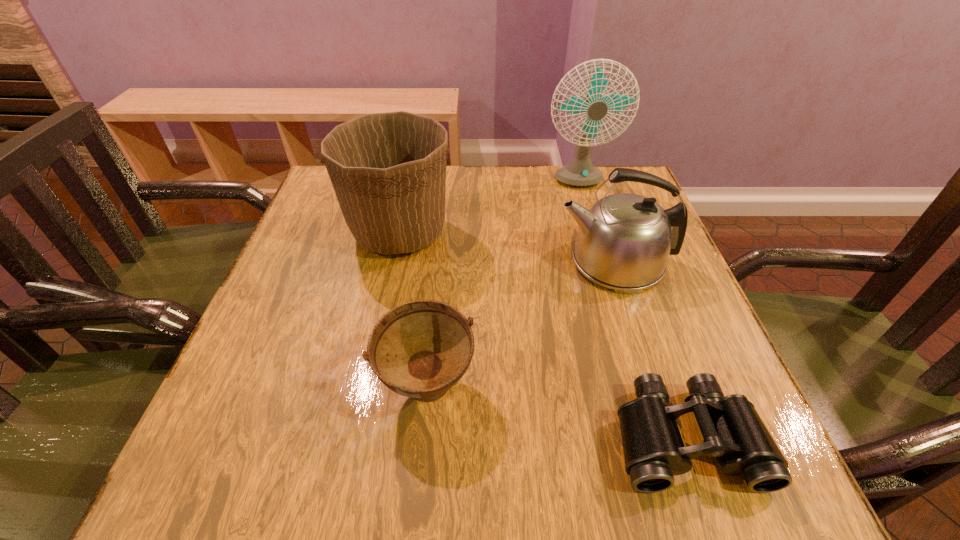
Locate an element on the screen. Image resolution: width=960 pixels, height=540 pixels. free point between the binoculars and the fan is located at coordinates (632, 310).

The height and width of the screenshot is (540, 960). I want to click on free area in between the farthest object and the flowerpot, so click(489, 208).

You are a GUI agent. You are given a task and a screenshot of the screen. Output one action in this format:
    pyautogui.click(x=<x>, y=<y>)
    Task: Click on the free space between the farthest object and the flowerpot
    
    Given the screenshot: What is the action you would take?
    pyautogui.click(x=489, y=208)

At what (x,y) coordinates should I click in order to perform the action: click on vacant area between the binoculars and the kettle. Please return your answer as a coordinate pair (x, y). The image size is (960, 540). Looking at the image, I should click on (650, 349).

At what (x,y) coordinates should I click in order to perform the action: click on unoccupied area between the flowerpot and the binoculars. Please return your answer as a coordinate pair (x, y). The width and height of the screenshot is (960, 540). Looking at the image, I should click on (542, 335).

Where is `object that can be found as the closest to the soup bowl`? object that can be found as the closest to the soup bowl is located at coordinates (733, 432).

This screenshot has height=540, width=960. Find the location of `object that ranks as the second closest to the flowerpot`. object that ranks as the second closest to the flowerpot is located at coordinates (624, 241).